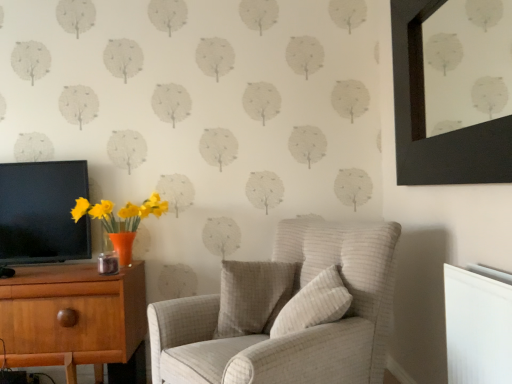
Question: Considering the positions of beige textured pillow at center, marked as the first pillow in a front-to-back arrangement, and wooden desk at left in the image, is beige textured pillow at center, marked as the first pillow in a front-to-back arrangement, taller or shorter than wooden desk at left?

Choices:
 (A) short
 (B) tall

Answer: (A)

Question: Looking at the image, does beige textured pillow at center, marked as the first pillow in a front-to-back arrangement, seem bigger or smaller compared to wooden desk at left?

Choices:
 (A) big
 (B) small

Answer: (B)

Question: Estimate the real-world distances between objects in this image. Which object is closer to the black matte picture frame at upper right?

Choices:
 (A) black glossy tv at left
 (B) light beige fabric armchair at center
 (C) white plastic radiator at lower right
 (D) textured white pillow at center, the 2th pillow positioned from the front
 (E) wooden desk at left

Answer: (C)

Question: Which object is the closest to the textured white pillow at center, the 2th pillow positioned from the front?

Choices:
 (A) wooden desk at left
 (B) beige textured pillow at center, marked as the first pillow in a front-to-back arrangement
 (C) black glossy tv at left
 (D) light beige fabric armchair at center
 (E) white plastic radiator at lower right

Answer: (D)